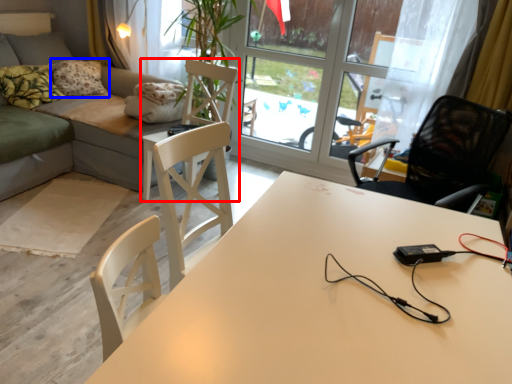
Question: Which of the following is the closest to the observer, chair (highlighted by a red box) or pillow (highlighted by a blue box)?

Choices:
 (A) chair
 (B) pillow

Answer: (A)